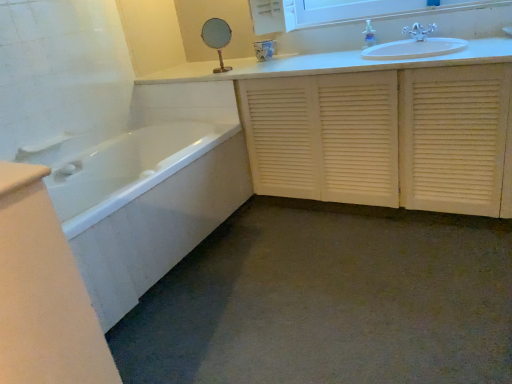
What are the coordinates of `free space in front of clear plastic soap dispenser at upper center` in the screenshot? It's located at (381, 43).